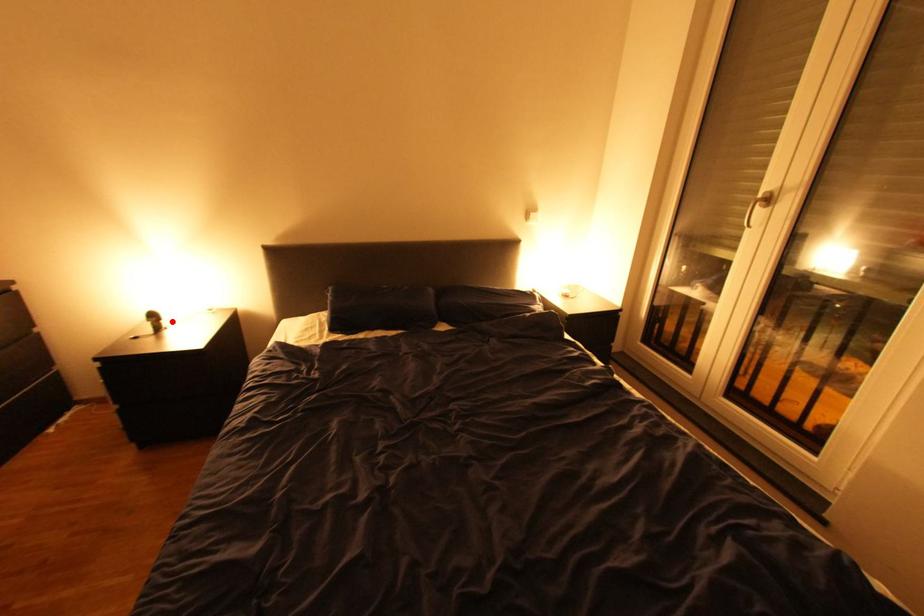
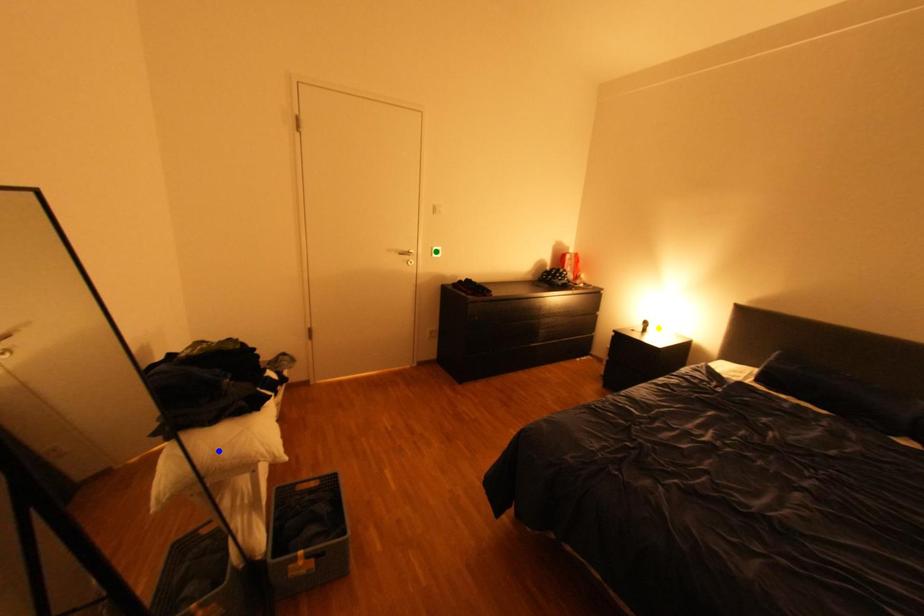
Question: I am providing you with two images of the same scene from different viewpoints. A red point is marked on the first image. You are given multiple points on the second image. Which point in image 2 is actually the same real-world point as the red point in image 1?

Choices:
 (A) yellow point
 (B) green point
 (C) blue point

Answer: (A)